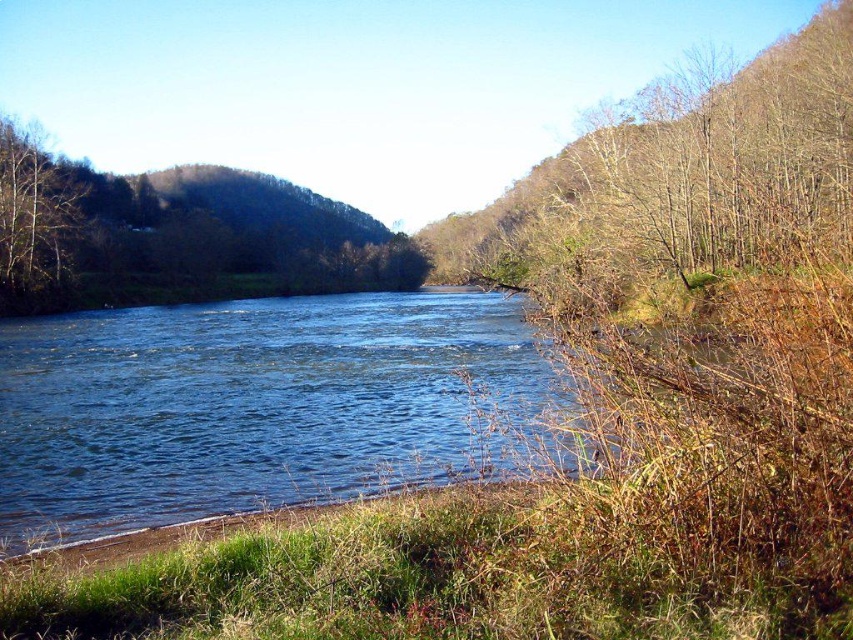
Question: Is brown leafy tree at center closer to camera compared to brown leafless tree at left?

Choices:
 (A) yes
 (B) no

Answer: (B)

Question: Does brown leafy tree at center appear on the right side of brown leafless tree at left?

Choices:
 (A) yes
 (B) no

Answer: (A)

Question: Among these points, which one is farthest from the camera?

Choices:
 (A) (21, 218)
 (B) (80, 260)

Answer: (B)

Question: Which point appears closest to the camera in this image?

Choices:
 (A) (163, 266)
 (B) (25, 186)

Answer: (B)

Question: Where is brown leafy tree at center located in relation to brown leafless tree at left in the image?

Choices:
 (A) left
 (B) right

Answer: (B)

Question: Among these objects, which one is nearest to the camera?

Choices:
 (A) brown leafless tree at left
 (B) brown leafy tree at center

Answer: (A)